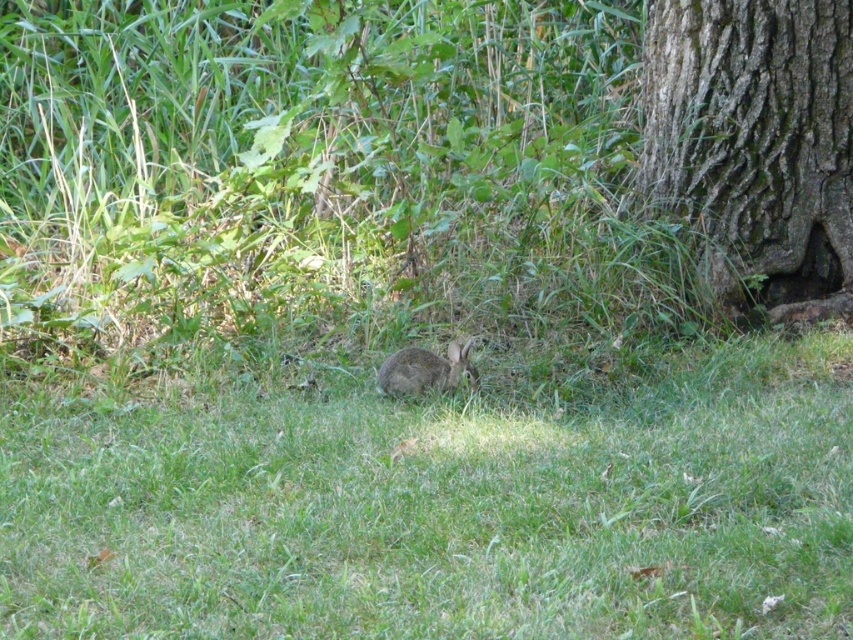
Question: Which object is closer to the camera taking this photo?

Choices:
 (A) gray textured bark at lower right
 (B) fuzzy brown rabbit at center

Answer: (B)

Question: Is gray textured bark at lower right thinner than fuzzy brown rabbit at center?

Choices:
 (A) no
 (B) yes

Answer: (A)

Question: Is gray textured bark at lower right further to the viewer compared to fuzzy brown rabbit at center?

Choices:
 (A) no
 (B) yes

Answer: (B)

Question: Which object is farther from the camera taking this photo?

Choices:
 (A) gray textured bark at lower right
 (B) fuzzy brown rabbit at center

Answer: (A)

Question: Does gray textured bark at lower right appear over fuzzy brown rabbit at center?

Choices:
 (A) yes
 (B) no

Answer: (A)